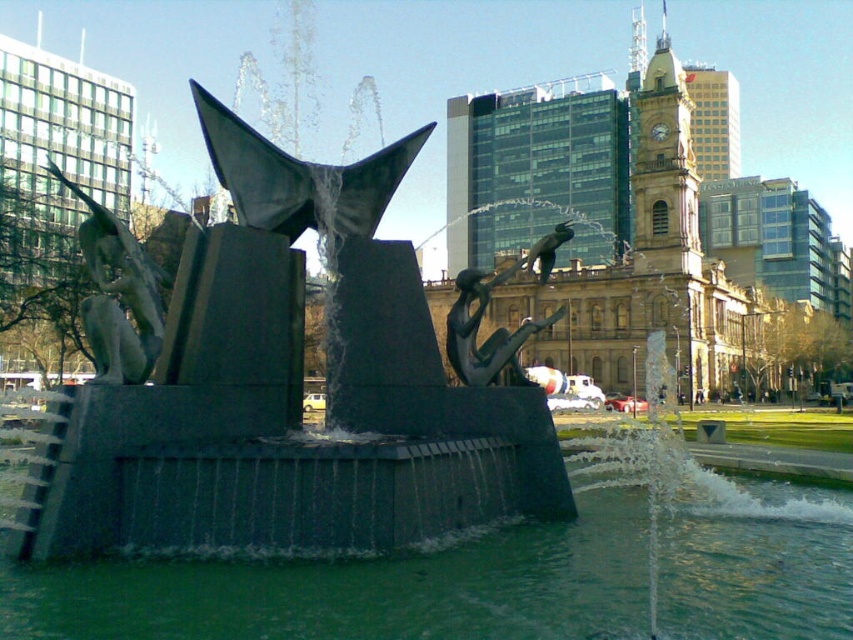
Which is behind, point (506, 548) or point (157, 310)?

Positioned behind is point (506, 548).

Consider the image. Is green water at fountain center thinner than polished bronze statue at left?

Indeed, green water at fountain center has a lesser width compared to polished bronze statue at left.

Locate an element on the screen. green water at fountain center is located at coordinates (370, 586).

Identify the location of green water at fountain center. (370, 586).

Which of these two, green water at fountain center or bronze textured figure at center, stands taller?

With more height is bronze textured figure at center.

Does green water at fountain center lie behind bronze textured figure at center?

No.

Who is more forward, (669,524) or (468,372)?

Point (468,372) is more forward.

Locate an element on the screen. green water at fountain center is located at coordinates (370, 586).

Is polished bronze statue at left wider than bronze textured figure at center?

Yes.

Is point (91, 353) positioned before point (465, 349)?

No, it is behind (465, 349).

Measure the distance between point (143, 305) and camera.

Point (143, 305) and camera are 35.07 meters apart.

At what (x,y) coordinates should I click in order to perform the action: click on polished bronze statue at left. Please return your answer as a coordinate pair (x, y). Looking at the image, I should click on (119, 296).